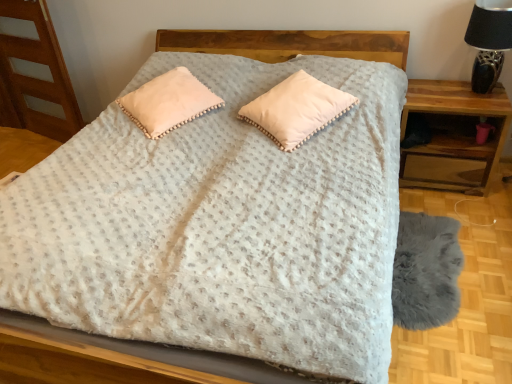
The height and width of the screenshot is (384, 512). Describe the element at coordinates (296, 109) in the screenshot. I see `pom-pom trim pillow at center, arranged as the second pillow when viewed from the left` at that location.

This screenshot has width=512, height=384. What are the coordinates of `black ceramic table lamp at upper right` in the screenshot? It's located at (489, 41).

Locate an element on the screen. This screenshot has width=512, height=384. wooden nightstand at right is located at coordinates (454, 136).

Describe the element at coordinates (426, 271) in the screenshot. I see `gray fluffy rug at lower right` at that location.

Locate an element on the screen. pom-pom trim pillow at center, arranged as the second pillow when viewed from the left is located at coordinates (296, 109).

Is black ceramic table lamp at upper right bigger or smaller than wooden nightstand at right?

In the image, black ceramic table lamp at upper right appears to be smaller than wooden nightstand at right.

From a real-world perspective, is black ceramic table lamp at upper right below wooden nightstand at right?

Incorrect, from a real-world perspective, black ceramic table lamp at upper right is higher than wooden nightstand at right.

At what (x,y) coordinates should I click in order to perform the action: click on nightstand beneath the black ceramic table lamp at upper right (from a real-world perspective). Please return your answer as a coordinate pair (x, y). The width and height of the screenshot is (512, 384). Looking at the image, I should click on (454, 136).

Is black ceramic table lamp at upper right positioned far away from wooden nightstand at right?

That's not correct — black ceramic table lamp at upper right is a little close to wooden nightstand at right.

Is point (264, 132) positioned before point (152, 111)?

Yes, it is in front of point (152, 111).

Is pom-pom trim pillow at center, acting as the first pillow starting from the right, behind peach velvety pillow at center, positioned as the 1th pillow in left-to-right order?

No, it is in front of peach velvety pillow at center, positioned as the 1th pillow in left-to-right order.

Does pom-pom trim pillow at center, acting as the first pillow starting from the right, turn towards peach velvety pillow at center, positioned as the 1th pillow in left-to-right order?

No, pom-pom trim pillow at center, acting as the first pillow starting from the right, is not facing towards peach velvety pillow at center, positioned as the 1th pillow in left-to-right order.

Is wooden nightstand at right not close to pom-pom trim pillow at center, arranged as the second pillow when viewed from the left?

No, there isn't a large distance between wooden nightstand at right and pom-pom trim pillow at center, arranged as the second pillow when viewed from the left.

Is pom-pom trim pillow at center, acting as the first pillow starting from the right, at the back of wooden nightstand at right?

No, pom-pom trim pillow at center, acting as the first pillow starting from the right, is not at the back of wooden nightstand at right.

Consider the image. Between wooden nightstand at right and pom-pom trim pillow at center, arranged as the second pillow when viewed from the left, which one appears on the left side from the viewer's perspective?

Positioned to the left is pom-pom trim pillow at center, arranged as the second pillow when viewed from the left.

How different are the orientations of wooden nightstand at right and pom-pom trim pillow at center, acting as the first pillow starting from the right, in degrees?

39.7 degrees separate the facing orientations of wooden nightstand at right and pom-pom trim pillow at center, acting as the first pillow starting from the right.

Is wooden nightstand at right bigger than gray fluffy rug at lower right?

Yes.

Does wooden nightstand at right appear on the left side of gray fluffy rug at lower right?

In fact, wooden nightstand at right is to the right of gray fluffy rug at lower right.

Does wooden nightstand at right come in front of gray fluffy rug at lower right?

No, the depth of wooden nightstand at right is greater than that of gray fluffy rug at lower right.

From a real-world perspective, who is located lower, wooden nightstand at right or gray fluffy rug at lower right?

gray fluffy rug at lower right.

Is gray fluffy rug at lower right placed right next to black ceramic table lamp at upper right?

No, gray fluffy rug at lower right is not next to black ceramic table lamp at upper right.

From the image's perspective, is gray fluffy rug at lower right beneath black ceramic table lamp at upper right?

Correct, gray fluffy rug at lower right appears lower than black ceramic table lamp at upper right in the image.

Considering the sizes of objects gray fluffy rug at lower right and black ceramic table lamp at upper right in the image provided, who is taller, gray fluffy rug at lower right or black ceramic table lamp at upper right?

black ceramic table lamp at upper right is taller.

Is gray fluffy rug at lower right aimed at black ceramic table lamp at upper right?

No.

What's the angular difference between pom-pom trim pillow at center, acting as the first pillow starting from the right, and black ceramic table lamp at upper right's facing directions?

pom-pom trim pillow at center, acting as the first pillow starting from the right, and black ceramic table lamp at upper right are facing 37.9 degrees away from each other.

Does pom-pom trim pillow at center, acting as the first pillow starting from the right, lie behind black ceramic table lamp at upper right?

No, it is not.

Who is shorter, pom-pom trim pillow at center, acting as the first pillow starting from the right, or black ceramic table lamp at upper right?

pom-pom trim pillow at center, acting as the first pillow starting from the right, is shorter.

Is gray fluffy rug at lower right to the right of wooden nightstand at right from the viewer's perspective?

In fact, gray fluffy rug at lower right is to the left of wooden nightstand at right.

Is the surface of gray fluffy rug at lower right in direct contact with wooden nightstand at right?

No, gray fluffy rug at lower right is not in contact with wooden nightstand at right.

Considering the sizes of gray fluffy rug at lower right and wooden nightstand at right in the image, is gray fluffy rug at lower right taller or shorter than wooden nightstand at right?

Clearly, gray fluffy rug at lower right is shorter compared to wooden nightstand at right.

Find the location of a particular element. The height and width of the screenshot is (384, 512). nightstand behind the black ceramic table lamp at upper right is located at coordinates (454, 136).

Find the location of a particular element. The width and height of the screenshot is (512, 384). pillow above the pom-pom trim pillow at center, arranged as the second pillow when viewed from the left (from the image's perspective) is located at coordinates (168, 102).

Considering their positions, is black ceramic table lamp at upper right positioned closer to gray fluffy rug at lower right than pom-pom trim pillow at center, acting as the first pillow starting from the right?

pom-pom trim pillow at center, acting as the first pillow starting from the right, is positioned closer to the anchor gray fluffy rug at lower right.

Estimate the real-world distances between objects in this image. Which object is closer to gray fluffy rug at lower right, pom-pom trim pillow at center, acting as the first pillow starting from the right, or black ceramic table lamp at upper right?

pom-pom trim pillow at center, acting as the first pillow starting from the right, lies closer to gray fluffy rug at lower right than the other object.

When comparing their distances from black ceramic table lamp at upper right, does wooden nightstand at right or gray fluffy rug at lower right seem closer?

Among the two, wooden nightstand at right is located nearer to black ceramic table lamp at upper right.

Estimate the real-world distances between objects in this image. Which object is further from pom-pom trim pillow at center, acting as the first pillow starting from the right, peach velvety pillow at center, positioned as the 2th pillow in right-to-left order, or black ceramic table lamp at upper right?

black ceramic table lamp at upper right.

Based on their spatial positions, is pom-pom trim pillow at center, arranged as the second pillow when viewed from the left, or wooden nightstand at right further from peach velvety pillow at center, positioned as the 1th pillow in left-to-right order?

wooden nightstand at right.

Estimate the real-world distances between objects in this image. Which object is further from pom-pom trim pillow at center, acting as the first pillow starting from the right, gray fluffy rug at lower right or peach velvety pillow at center, positioned as the 2th pillow in right-to-left order?

gray fluffy rug at lower right lies further to pom-pom trim pillow at center, acting as the first pillow starting from the right, than the other object.

Considering their positions, is black ceramic table lamp at upper right positioned further to gray fluffy rug at lower right than peach velvety pillow at center, positioned as the 2th pillow in right-to-left order?

Based on the image, peach velvety pillow at center, positioned as the 2th pillow in right-to-left order, appears to be further to gray fluffy rug at lower right.

Based on their spatial positions, is gray fluffy rug at lower right or peach velvety pillow at center, positioned as the 2th pillow in right-to-left order, closer to wooden nightstand at right?

Among the two, gray fluffy rug at lower right is located nearer to wooden nightstand at right.

What are the coordinates of `cat bed located between peach velvety pillow at center, positioned as the 1th pillow in left-to-right order, and wooden nightstand at right in the left-right direction` in the screenshot? It's located at point(426,271).

I want to click on pillow situated between peach velvety pillow at center, positioned as the 1th pillow in left-to-right order, and black ceramic table lamp at upper right from left to right, so click(x=296, y=109).

I want to click on pillow between peach velvety pillow at center, positioned as the 2th pillow in right-to-left order, and gray fluffy rug at lower right from left to right, so click(296, 109).

Image resolution: width=512 pixels, height=384 pixels. Find the location of `nightstand between black ceramic table lamp at upper right and gray fluffy rug at lower right vertically`. nightstand between black ceramic table lamp at upper right and gray fluffy rug at lower right vertically is located at coordinates (454, 136).